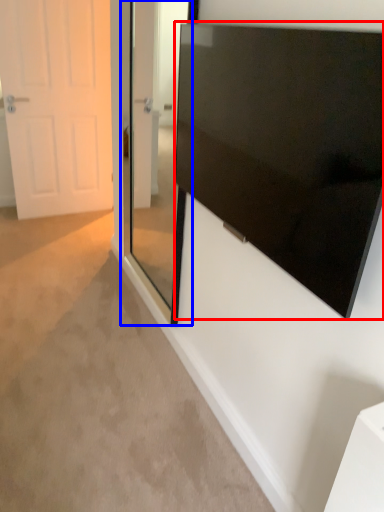
Question: Which of the following is the farthest to the observer, screen (highlighted by a red box) or glass door (highlighted by a blue box)?

Choices:
 (A) screen
 (B) glass door

Answer: (B)